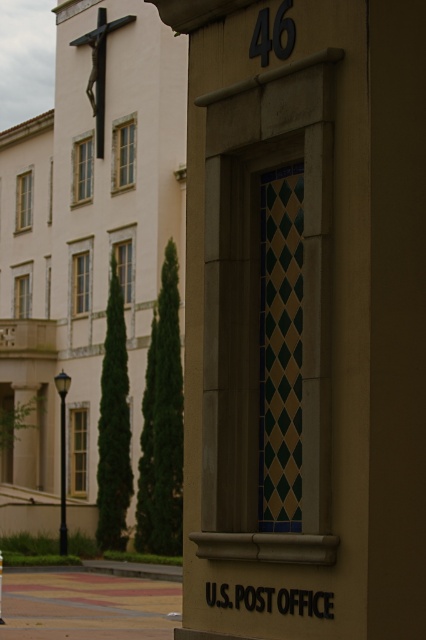
You are a visitor approaching the building and notice the black metal crucifix at upper left and the smooth black pole at left. Which object is positioned closer to the center of the building?

The black metal crucifix at upper left is closer to the center of the building because it is positioned to the right of the smooth black pole at left, meaning it is nearer to the central area.